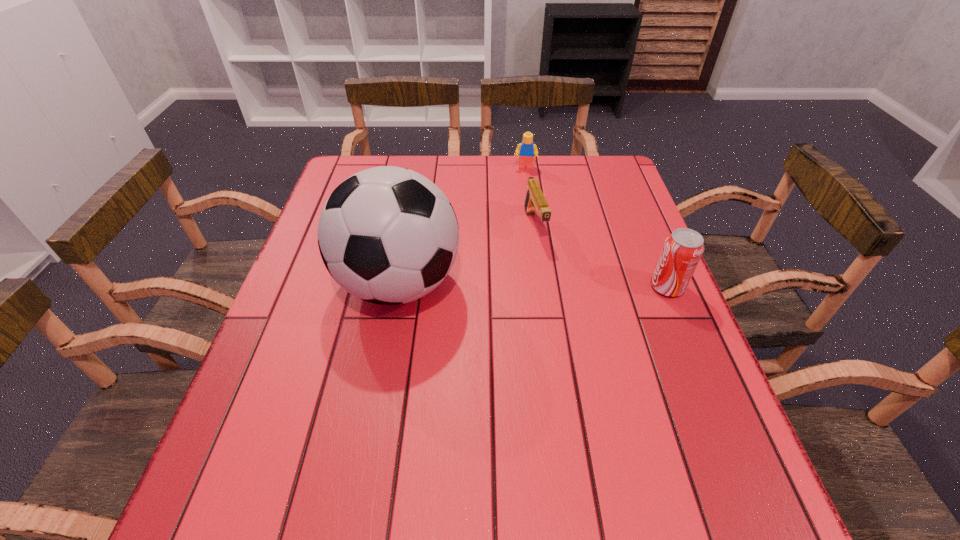
At what (x,y) coordinates should I click in order to perform the action: click on empty space between the soccer ball and the farthest object. Please return your answer as a coordinate pair (x, y). This screenshot has width=960, height=540. Looking at the image, I should click on (462, 226).

The height and width of the screenshot is (540, 960). Find the location of `vacant point located between the Lego and the soccer ball`. vacant point located between the Lego and the soccer ball is located at coordinates (462, 226).

Find the location of a particular element. Image resolution: width=960 pixels, height=540 pixels. empty location between the Lego and the leftmost object is located at coordinates (462, 226).

Select which object is the closest to the tallest object. Please provide its 2D coordinates. Your answer should be formatted as a tuple, i.e. [(x, y)], where the tuple contains the x and y coordinates of a point satisfying the conditions above.

[(535, 200)]

Identify the location of object that is the closest to the soccer ball. This screenshot has width=960, height=540. (535, 200).

What are the coordinates of `free spot that satisfies the following two spatial constraints: 1. on the front side of the Lego; 2. on the left side of the pistol` in the screenshot? It's located at (533, 225).

You are a GUI agent. You are given a task and a screenshot of the screen. Output one action in this format:
    pyautogui.click(x=<x>, y=<y>)
    Task: Click on the free space that satisfies the following two spatial constraints: 1. on the front side of the soda can; 2. on the logo side of the leftmost object
    This screenshot has width=960, height=540.
    Given the screenshot: What is the action you would take?
    pyautogui.click(x=398, y=287)

Locate an element on the screen. vacant position in the image that satisfies the following two spatial constraints: 1. on the front side of the soda can; 2. on the logo side of the soccer ball is located at coordinates (398, 287).

The height and width of the screenshot is (540, 960). I want to click on vacant space that satisfies the following two spatial constraints: 1. on the front side of the pistol; 2. on the logo side of the rightmost object, so click(x=543, y=287).